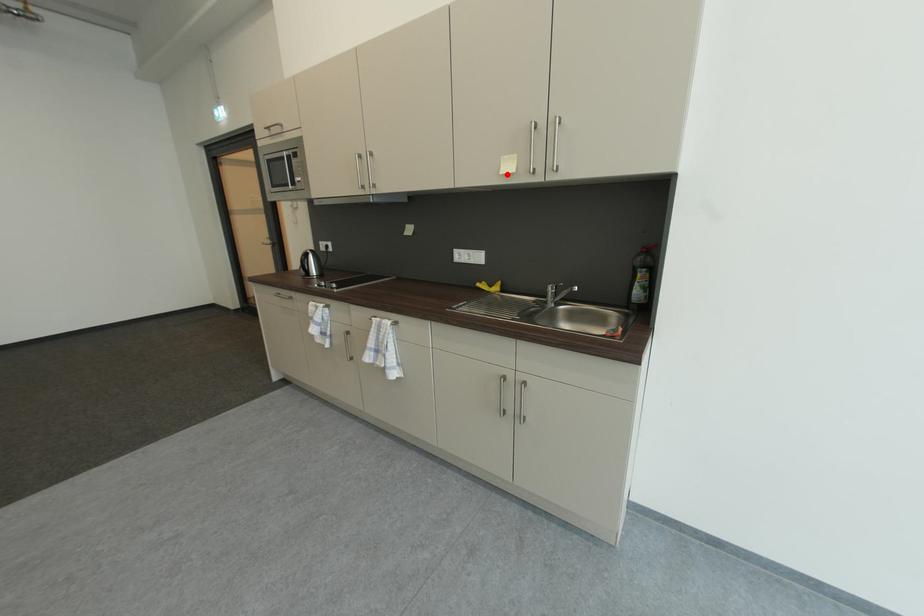
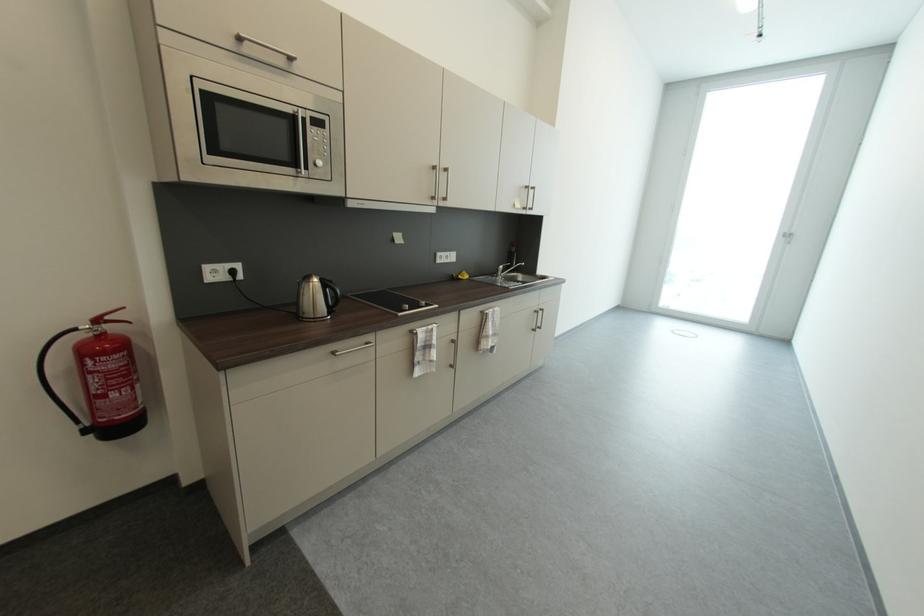
Question: I am providing you with two images of the same scene from different viewpoints. In image1, a red point is highlighted. Considering the same 3D point in image2, which of the following is correct?

Choices:
 (A) It is closer
 (B) It is farther

Answer: (A)